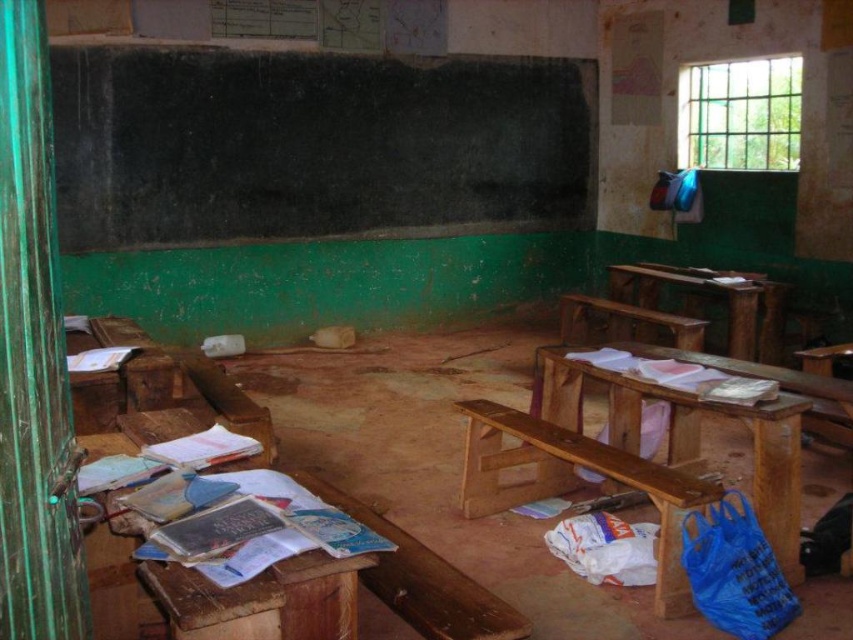
You are a student trying to clean the classroom. You have a 3.5 meter long mop. You need to reach the black chalkboard at upper center from the wooden bench at center. Can you reach it with your mop?

The black chalkboard at upper center is 3.71 meters from the wooden bench at center. Since the mop is only 3.5 meters long, it is not long enough to reach the black chalkboard at upper center from the wooden bench at center.

You are a student entering the classroom and see the black chalkboard at upper center and the brown wooden table at center. Which object is positioned to the left when facing the front of the room?

The black chalkboard at upper center is positioned to the left of the brown wooden table at center when facing the front of the room.

You are a student entering the classroom and need to write on the black chalkboard at upper center. Can you reach it from the brown wooden table at center?

The black chalkboard at upper center is located above the brown wooden table at center, so you can reach it by standing on the table or using a stool.